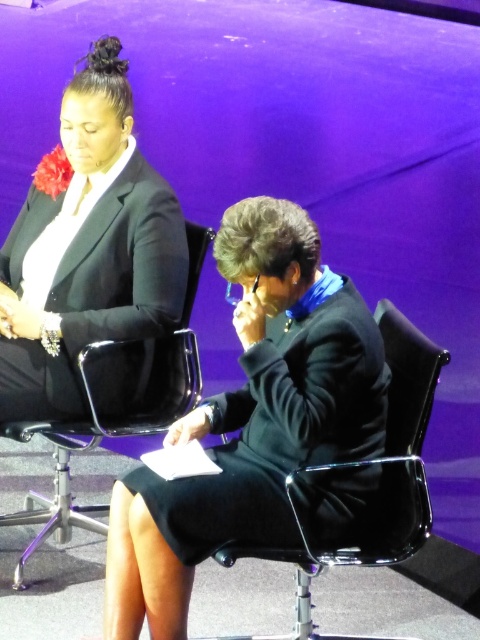
Question: Based on their relative distances, which object is farther from the black matte blazer at upper left?

Choices:
 (A) black matte dress at lower center
 (B) black plastic chair at center
 (C) black plastic swivel chair at center

Answer: (C)

Question: Among these points, which one is nearest to the camera?

Choices:
 (A) (247, 554)
 (B) (147, 282)
 (C) (61, 513)

Answer: (A)

Question: Can you confirm if black plastic swivel chair at center is thinner than black plastic chair at center?

Choices:
 (A) yes
 (B) no

Answer: (A)

Question: Does black matte dress at lower center have a lesser width compared to black plastic chair at center?

Choices:
 (A) no
 (B) yes

Answer: (B)

Question: In this image, where is black matte blazer at upper left located relative to black plastic swivel chair at center?

Choices:
 (A) above
 (B) below

Answer: (A)

Question: Among these objects, which one is farthest from the camera?

Choices:
 (A) black plastic swivel chair at center
 (B) black plastic chair at center
 (C) black matte dress at lower center

Answer: (B)